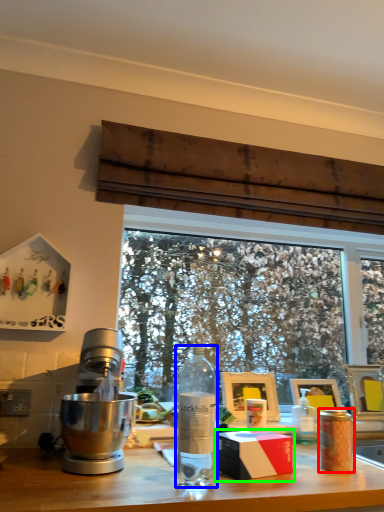
Question: Which object is the closest to the coffee cup (highlighted by a red box)? Choose among these: bottle (highlighted by a blue box) or box (highlighted by a green box).

Choices:
 (A) bottle
 (B) box

Answer: (B)